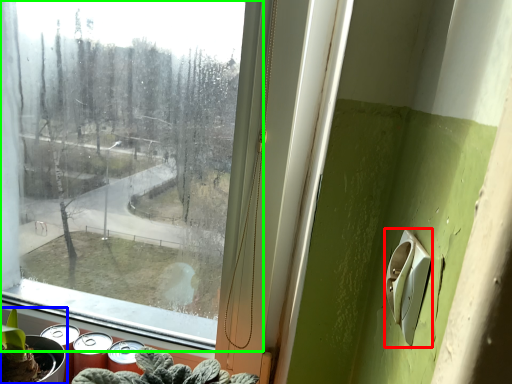
Question: Which object is positioned closest to light switch (highlighted by a red box)? Select from houseplant (highlighted by a blue box) and window (highlighted by a green box).

Choices:
 (A) houseplant
 (B) window

Answer: (A)